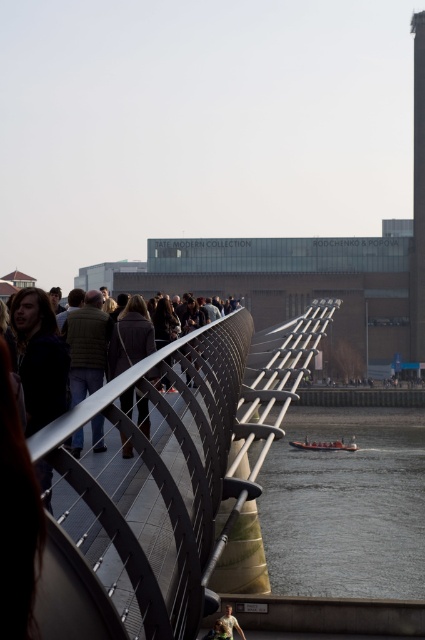
Is brown textured jacket at left further to the viewer compared to dark brown wool coat at center?

Yes.

Between brown textured jacket at left and dark brown wool coat at center, which one is positioned lower?

Positioned lower is brown textured jacket at left.

This screenshot has width=425, height=640. Describe the element at coordinates (87, 346) in the screenshot. I see `brown textured jacket at left` at that location.

Image resolution: width=425 pixels, height=640 pixels. Find the location of `brown textured jacket at left`. brown textured jacket at left is located at coordinates (87, 346).

What are the coordinates of `dark brown wool coat at center` in the screenshot? It's located at (130, 337).

Which is in front, point (130, 332) or point (221, 616)?

Point (130, 332) is in front.

The width and height of the screenshot is (425, 640). What are the coordinates of `dark brown wool coat at center` in the screenshot? It's located at (130, 337).

Who is lower down, brown textured jacket at left or light brown leather jacket at lower center?

light brown leather jacket at lower center is lower down.

Who is taller, brown textured jacket at left or light brown leather jacket at lower center?

Standing taller between the two is light brown leather jacket at lower center.

This screenshot has width=425, height=640. What are the coordinates of `brown textured jacket at left` in the screenshot? It's located at (87, 346).

At what (x,y) coordinates should I click in order to perform the action: click on brown textured jacket at left. Please return your answer as a coordinate pair (x, y). Looking at the image, I should click on (87, 346).